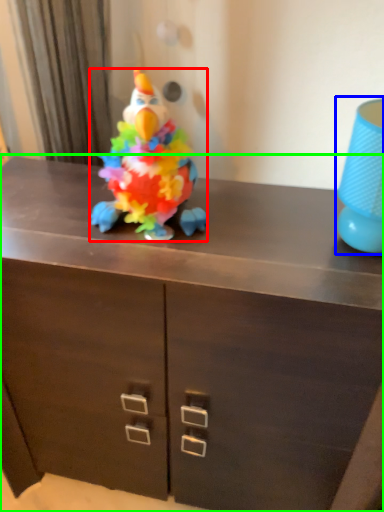
Question: Which object is the farthest from toy (highlighted by a red box)? Choose among these: lamp (highlighted by a blue box) or chest of drawers (highlighted by a green box).

Choices:
 (A) lamp
 (B) chest of drawers

Answer: (A)